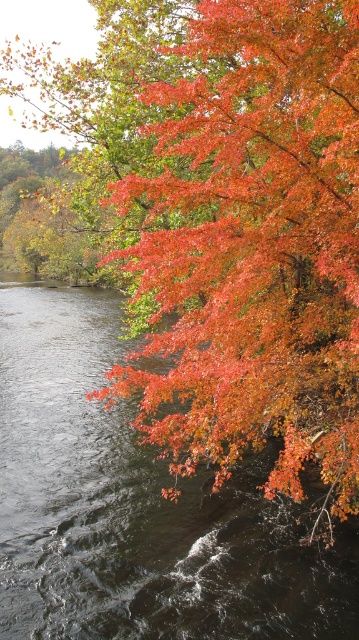
Is point (253, 17) closer to camera compared to point (31, 342)?

Yes, point (253, 17) is in front of point (31, 342).

Is shiny orange leaves at upper right wider than dark water at lower left?

No.

Does point (287, 132) come behind point (136, 586)?

Yes, it is behind point (136, 586).

The image size is (359, 640). I want to click on shiny orange leaves at upper right, so click(x=253, y=244).